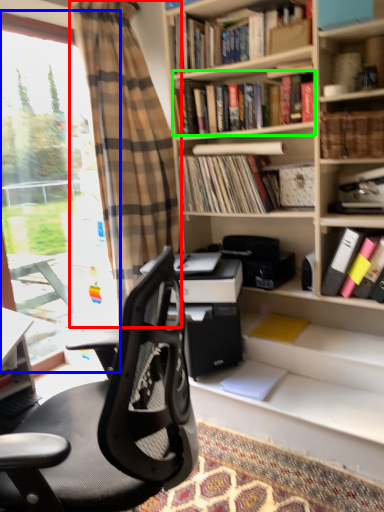
Question: Considering the real-world distances, which object is farthest from curtain (highlighted by a red box)? window (highlighted by a blue box) or book (highlighted by a green box)?

Choices:
 (A) window
 (B) book

Answer: (A)